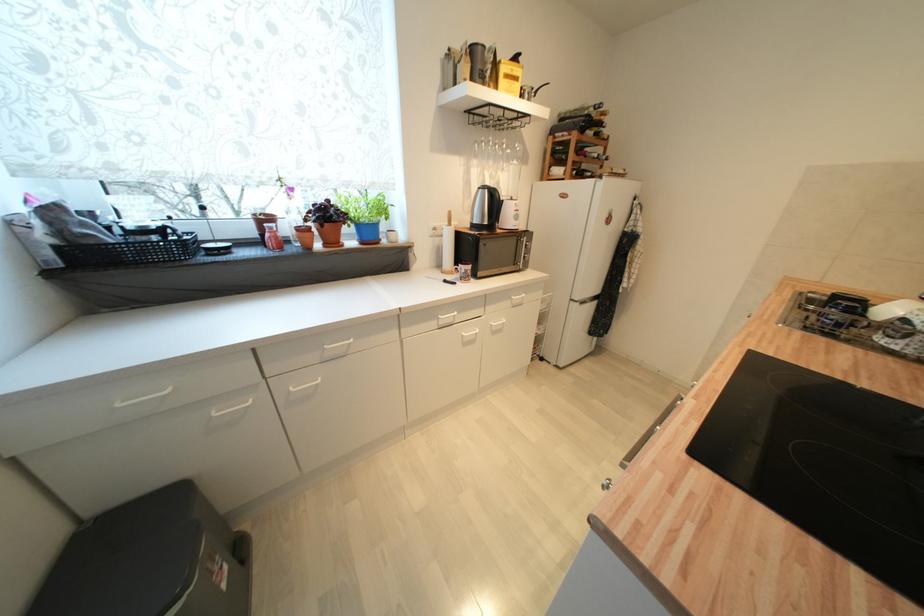
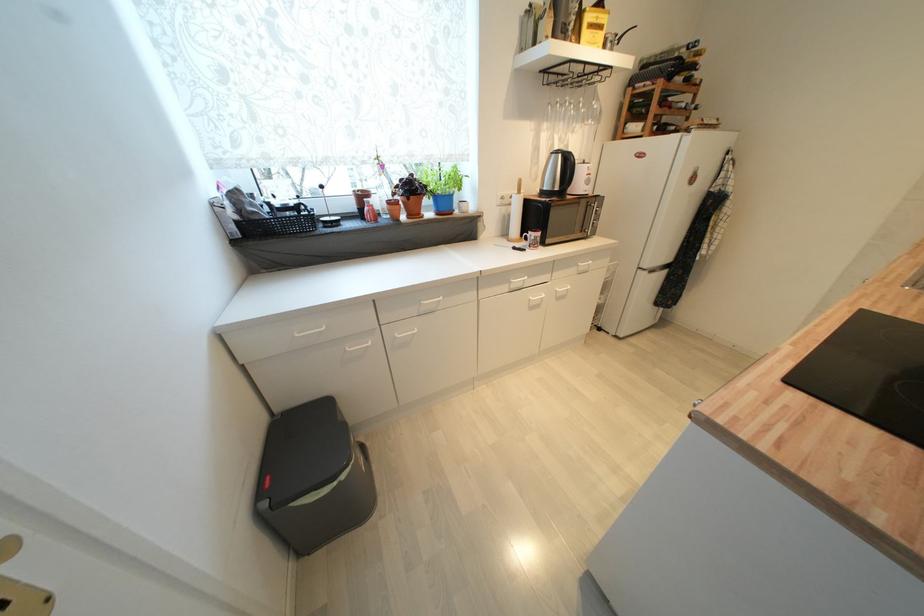
The point at (480, 164) is marked in the first image. Where is the corresponding point in the second image?

(551, 127)